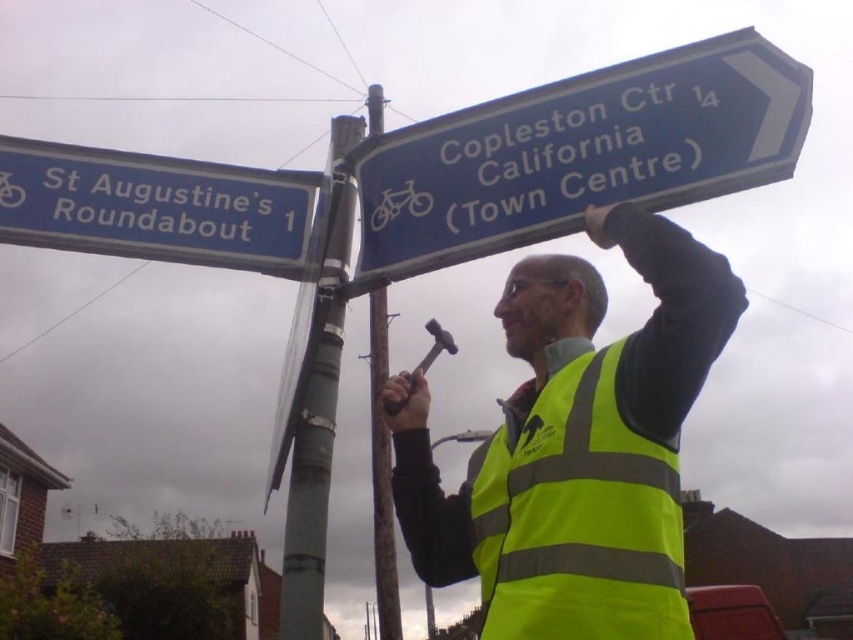
You are a pedestrian trying to cross the street and notice the yellow reflective safety vest at center and the gray metallic pole at center. Which object takes up more horizontal space from your viewpoint?

The yellow reflective safety vest at center might be wider than gray metallic pole at center, so it likely takes up more horizontal space from your viewpoint.

You are a cyclist planning to reach the town centre via the route indicated by the blue directional road sign. As you approach the signpost where the gray metallic pole at center and yellow reflective safety vest at center are located, which object would you see first from your perspective?

The gray metallic pole at center would be seen first because the yellow reflective safety vest at center is positioned to its right, meaning the pole is closer to your line of sight when approaching the signpost.